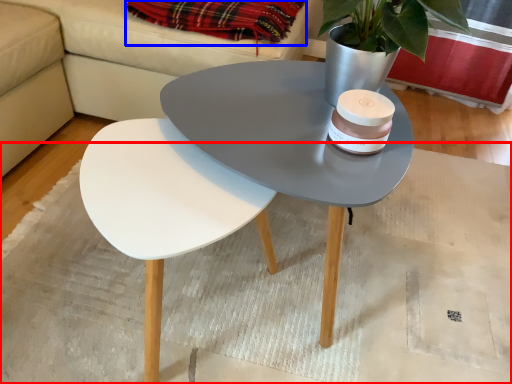
Question: Among these objects, which one is farthest to the camera, mat (highlighted by a red box) or blanket (highlighted by a blue box)?

Choices:
 (A) mat
 (B) blanket

Answer: (B)